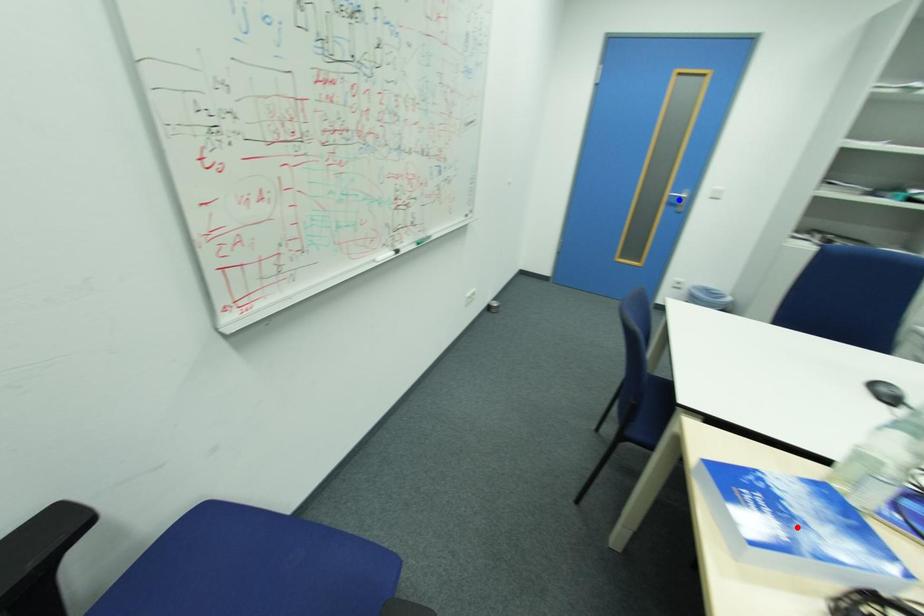
Question: Two points are marked on the image. Which point is closer to the camera?

Choices:
 (A) Blue point is closer.
 (B) Red point is closer.

Answer: (B)